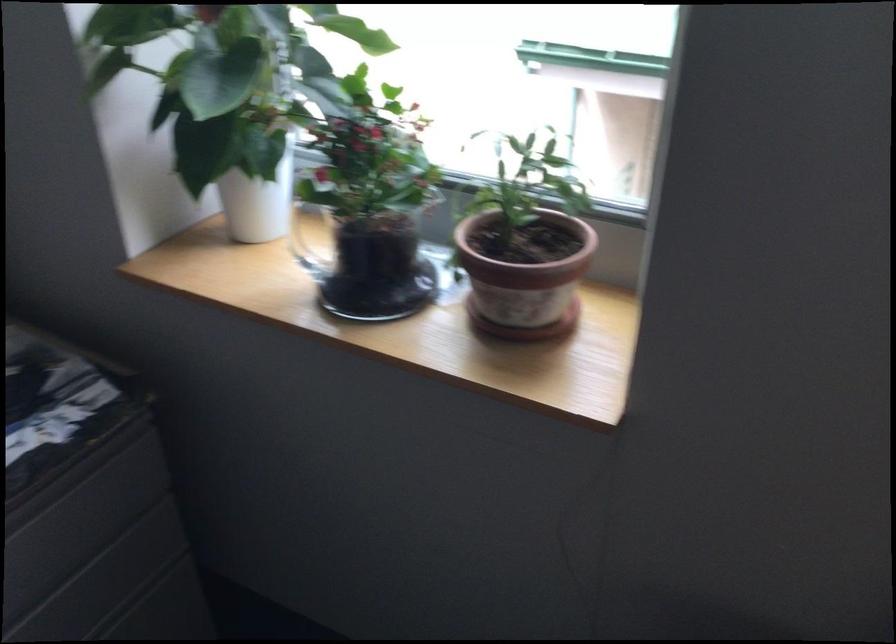
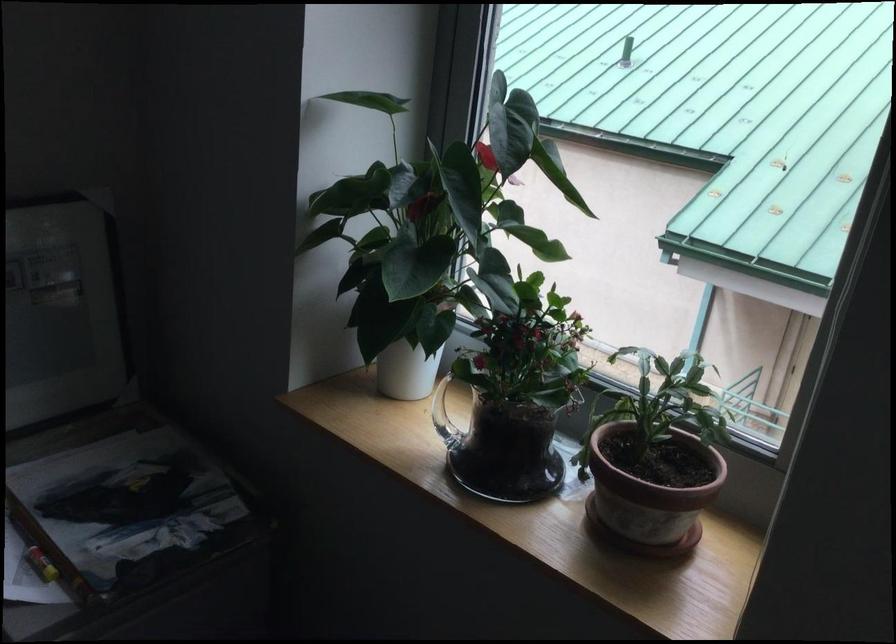
The point at [254,207] is marked in the first image. Where is the corresponding point in the second image?

(407, 368)